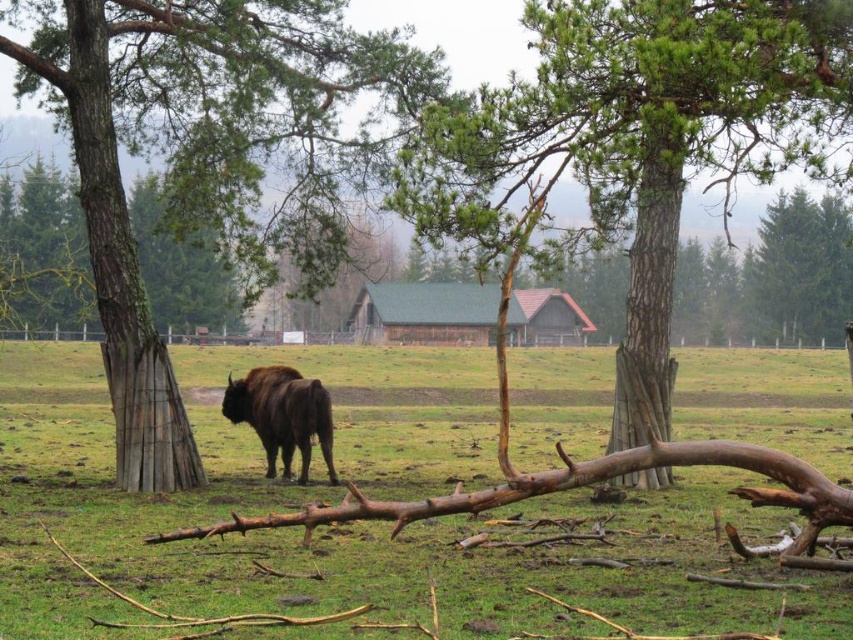
Question: Based on their relative distances, which object is farther from the brown furry yak at center?

Choices:
 (A) brown fur bison at center
 (B) smooth bark tree at center
 (C) brown bark tree at left

Answer: (A)

Question: Does smooth bark tree at center appear on the left side of brown furry yak at center?

Choices:
 (A) yes
 (B) no

Answer: (B)

Question: Is brown fur bison at center above brown furry yak at center?

Choices:
 (A) yes
 (B) no

Answer: (A)

Question: Which point is farther to the camera?

Choices:
 (A) (793, 579)
 (B) (321, 440)
 (C) (291, 70)

Answer: (C)

Question: Can you confirm if brown bark tree at left is bigger than smooth bark tree at center?

Choices:
 (A) no
 (B) yes

Answer: (B)

Question: Which is farther from the brown furry yak at center?

Choices:
 (A) smooth bark tree at center
 (B) brown bark tree at left
 (C) brown fur bison at center

Answer: (C)